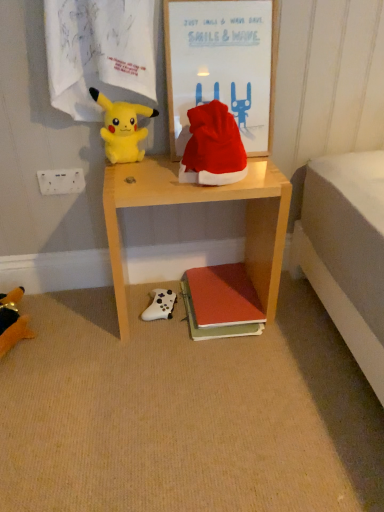
Where is `vacant area on top of matte orange book at lower center (from a real-world perspective)`? The height and width of the screenshot is (512, 384). vacant area on top of matte orange book at lower center (from a real-world perspective) is located at coordinates (229, 288).